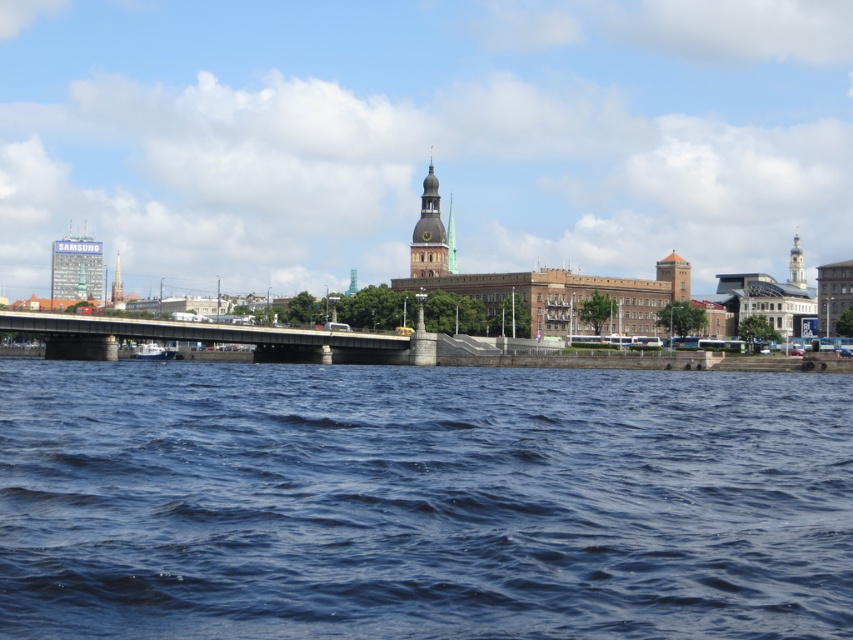
Based on the photo, you are standing at the point labeled as point (431, 236) in the waterfront cityscape. What structure are you currently on?

The point (431, 236) is on the smooth stone tower at center, so you are currently on the smooth stone tower at center.

You are an architect evaluating the cityscape. You need to determine the spatial relationship between the smooth stone tower at center and the blue glass tower at upper left. Which one is positioned higher in the image?

The smooth stone tower at center is located above the blue glass tower at upper left, so it is positioned higher in the image.

You are an architect analyzing the cityscape. You see the smooth silver tower at upper center and the brushed metal tower at left. Which tower is shorter?

The smooth silver tower at upper center is shorter than the brushed metal tower at left.